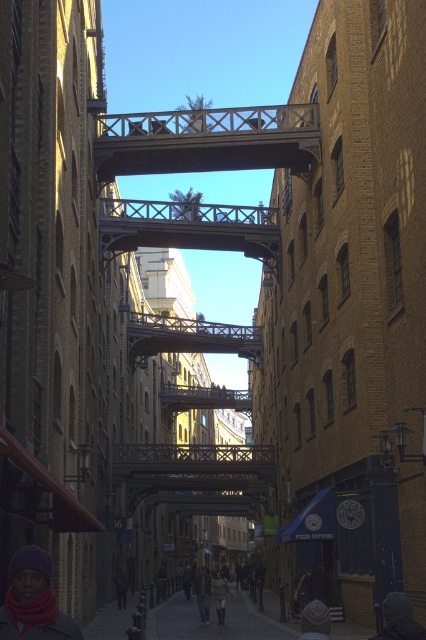
The height and width of the screenshot is (640, 426). What do you see at coordinates (207, 140) in the screenshot?
I see `wooden bridge at center` at bounding box center [207, 140].

Does point (247, 118) come behind point (221, 589)?

That is False.

Where is `wooden bridge at center`? wooden bridge at center is located at coordinates (207, 140).

Between point (204, 568) and point (222, 611), which one is positioned in front?

Point (222, 611) is in front.

Is point (206, 586) in front of point (224, 592)?

No.

Identify the location of light beige coat at center. (203, 593).

Between knitted wool hat at lower center and light beige coat at center, which one is positioned lower?

light beige coat at center is lower down.

Is knitted wool hat at lower center wider than light beige coat at center?

No, knitted wool hat at lower center is not wider than light beige coat at center.

Identify the location of knitted wool hat at lower center. (314, 621).